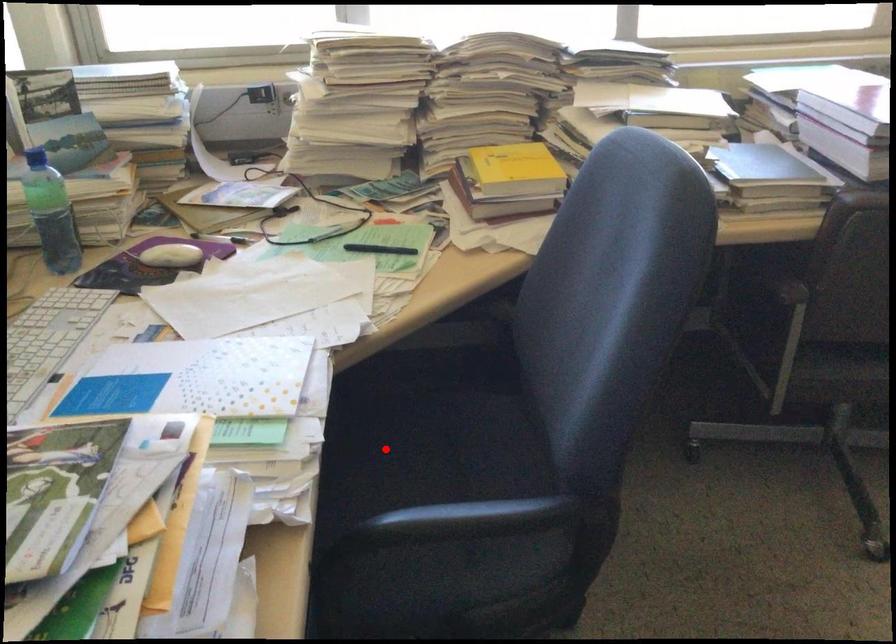
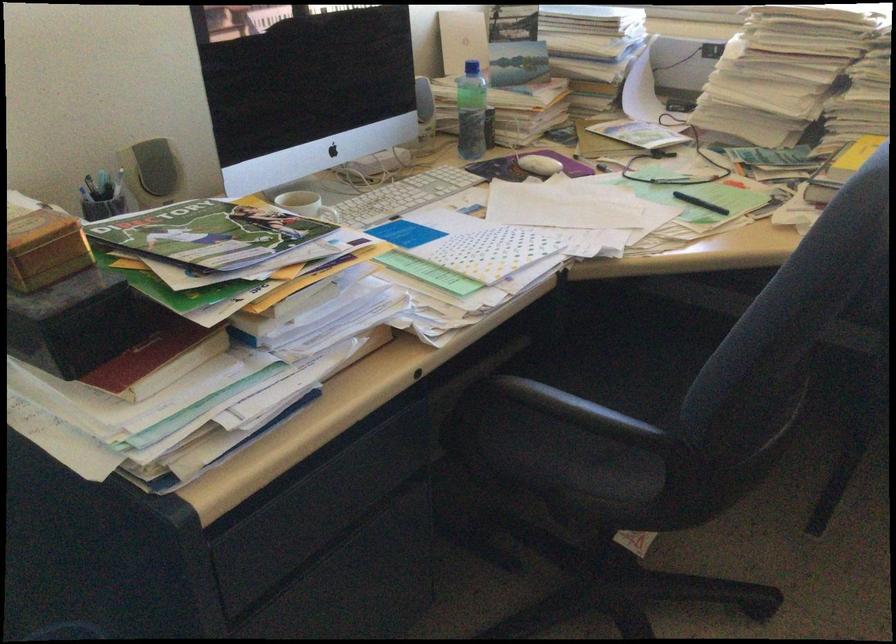
Question: I am providing you with two images of the same scene from different viewpoints. A red point is shown in image1. For the corresponding object point in image2, is it positioned nearer or farther from the camera?

Choices:
 (A) Nearer
 (B) Farther

Answer: (B)